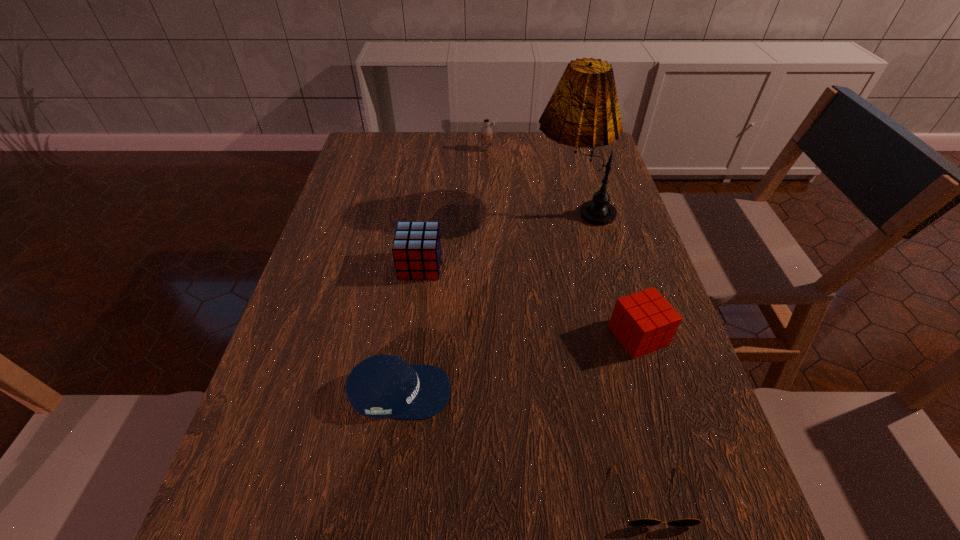
Where is `vacant point located between the fifth nearest object and the second nearest object`? The height and width of the screenshot is (540, 960). vacant point located between the fifth nearest object and the second nearest object is located at coordinates (486, 301).

At what (x,y) coordinates should I click in order to perform the action: click on unoccupied position between the tallest object and the chocolate milk. Please return your answer as a coordinate pair (x, y). Image resolution: width=960 pixels, height=540 pixels. Looking at the image, I should click on (529, 179).

I want to click on empty space between the third object from left to right and the fifth tallest object, so click(444, 271).

This screenshot has width=960, height=540. I want to click on free space between the nearest object and the right cube, so click(645, 416).

The image size is (960, 540). What are the coordinates of `vacant area that lies between the baseball cap and the farther cube` in the screenshot? It's located at (410, 329).

Where is `free point between the chocolate milk and the left cube`? free point between the chocolate milk and the left cube is located at coordinates (453, 207).

Choose which object is the fourth nearest neighbor to the chocolate milk. Please provide its 2D coordinates. Your answer should be formatted as a tuple, i.e. [(x, y)], where the tuple contains the x and y coordinates of a point satisfying the conditions above.

[(381, 386)]

Choose which object is the third nearest neighbor to the baseball cap. Please provide its 2D coordinates. Your answer should be formatted as a tuple, i.e. [(x, y)], where the tuple contains the x and y coordinates of a point satisfying the conditions above.

[(643, 322)]

Find the location of a particular element. free space that satisfies the following two spatial constraints: 1. on the front side of the third nearest object; 2. on the front-facing side of the second nearest object is located at coordinates (655, 392).